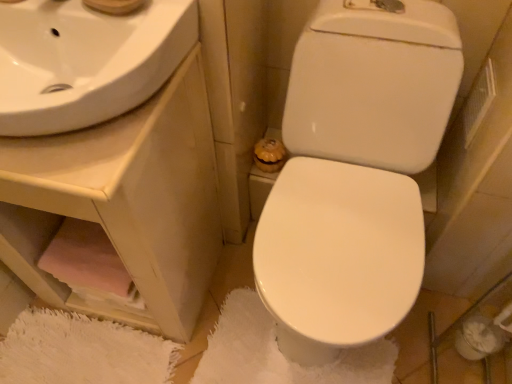
Where is `vacant area that lies between pink fabric at lower left and white fluffy bath mat at center`? vacant area that lies between pink fabric at lower left and white fluffy bath mat at center is located at coordinates (176, 343).